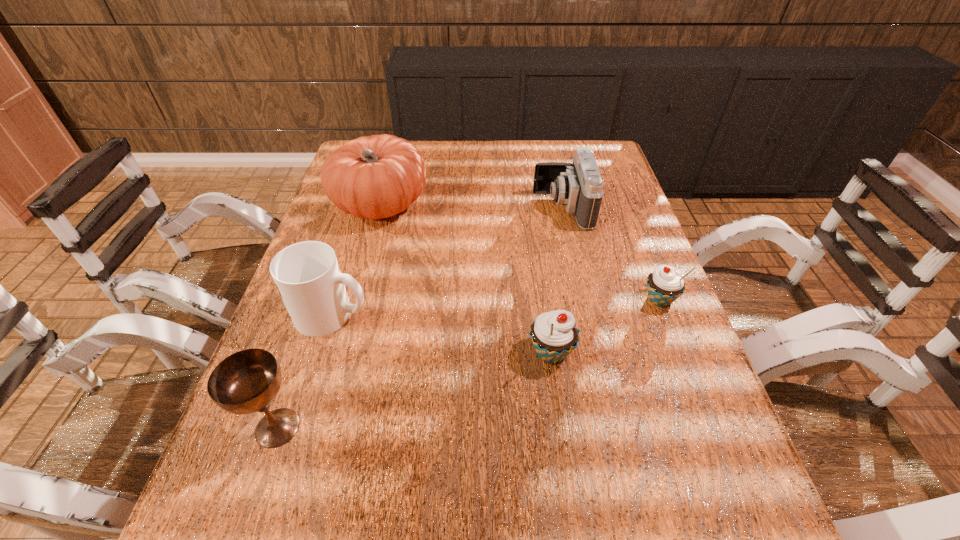
Where is `cupcake that is at the right edge`? Image resolution: width=960 pixels, height=540 pixels. cupcake that is at the right edge is located at coordinates (664, 285).

This screenshot has height=540, width=960. I want to click on camera located at the right edge, so click(x=578, y=186).

The width and height of the screenshot is (960, 540). I want to click on object located in the near left corner section of the desktop, so click(x=247, y=381).

In the image, there is a desktop. Identify the location of free space at the far edge. (444, 168).

You are a GUI agent. You are given a task and a screenshot of the screen. Output one action in this format:
    pyautogui.click(x=<x>, y=<y>)
    Task: Click on the vacant space at the near edge of the desktop
    
    Given the screenshot: What is the action you would take?
    pyautogui.click(x=632, y=455)

The image size is (960, 540). In the image, there is a desktop. Find the location of `free space at the left edge`. free space at the left edge is located at coordinates (349, 214).

In order to click on vacant space at the right edge of the desktop in this screenshot , I will do `click(633, 365)`.

Find the location of `vacant region at the near left corner`. vacant region at the near left corner is located at coordinates (220, 463).

This screenshot has width=960, height=540. I want to click on vacant position at the far right corner of the desktop, so click(x=599, y=145).

This screenshot has height=540, width=960. Find the location of `blank region between the mug and the pumpkin`. blank region between the mug and the pumpkin is located at coordinates (356, 259).